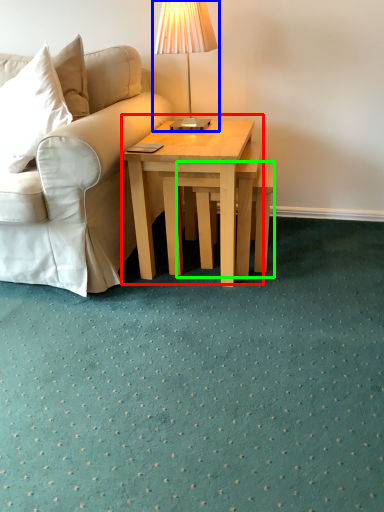
Question: Estimate the real-world distances between objects in this image. Which object is closer to coffee table (highlighted by a red box), table lamp (highlighted by a blue box) or stool (highlighted by a green box)?

Choices:
 (A) table lamp
 (B) stool

Answer: (B)